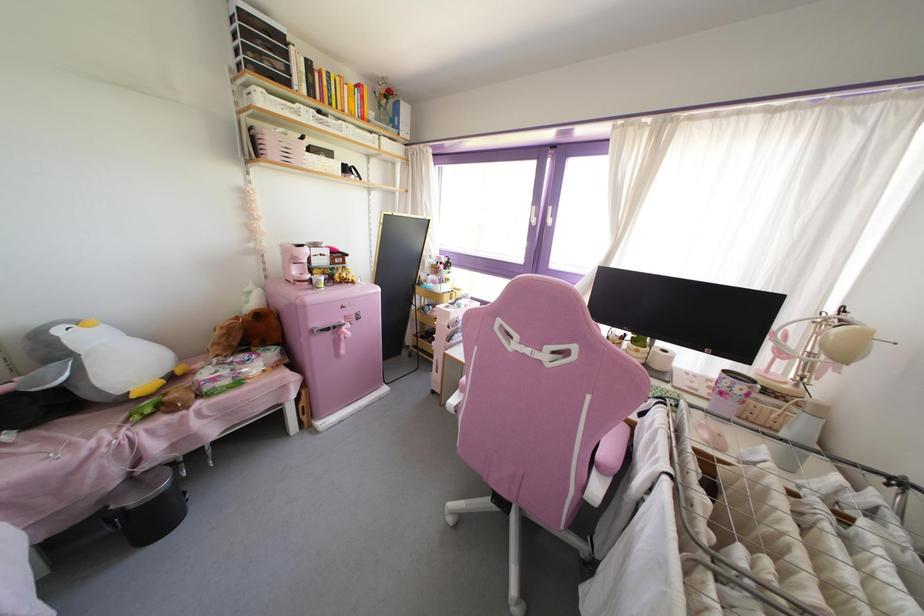
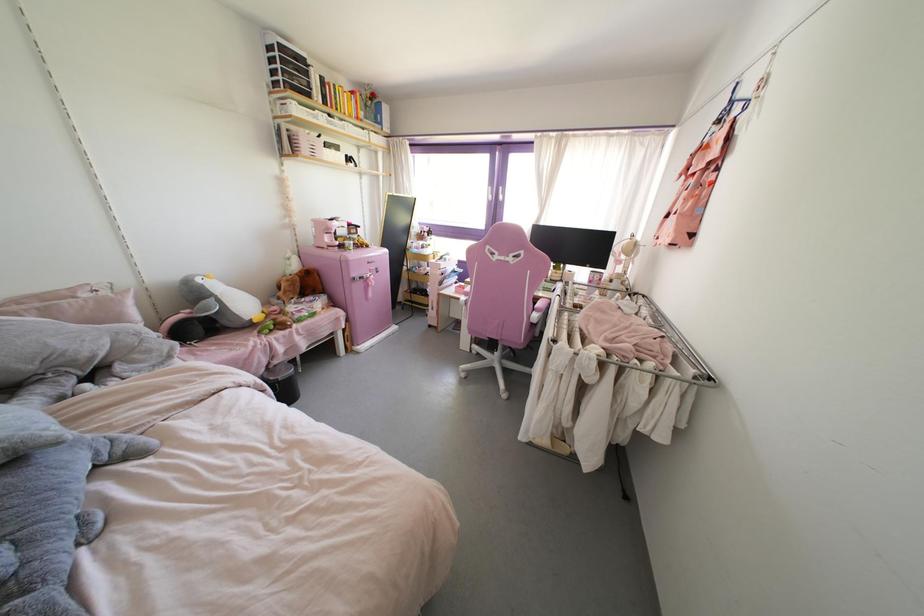
Where in the second image is the point corresponding to [134,395] from the first image?

(254, 320)